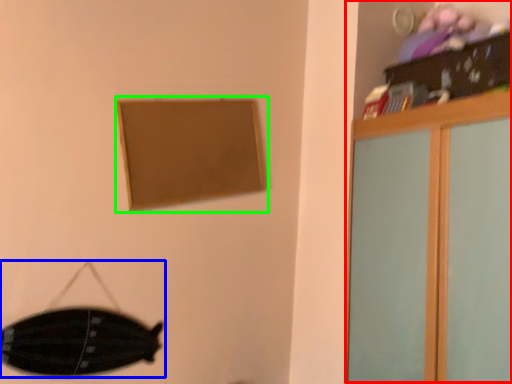
Question: Which is farther away from dresser (highlighted by a red box)? swivel chair (highlighted by a blue box) or picture frame (highlighted by a green box)?

Choices:
 (A) swivel chair
 (B) picture frame

Answer: (A)